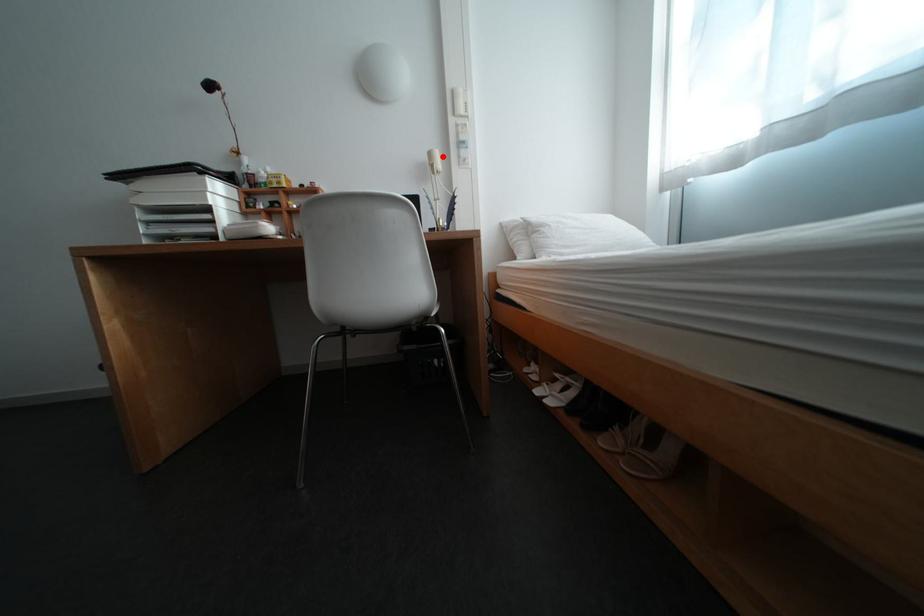
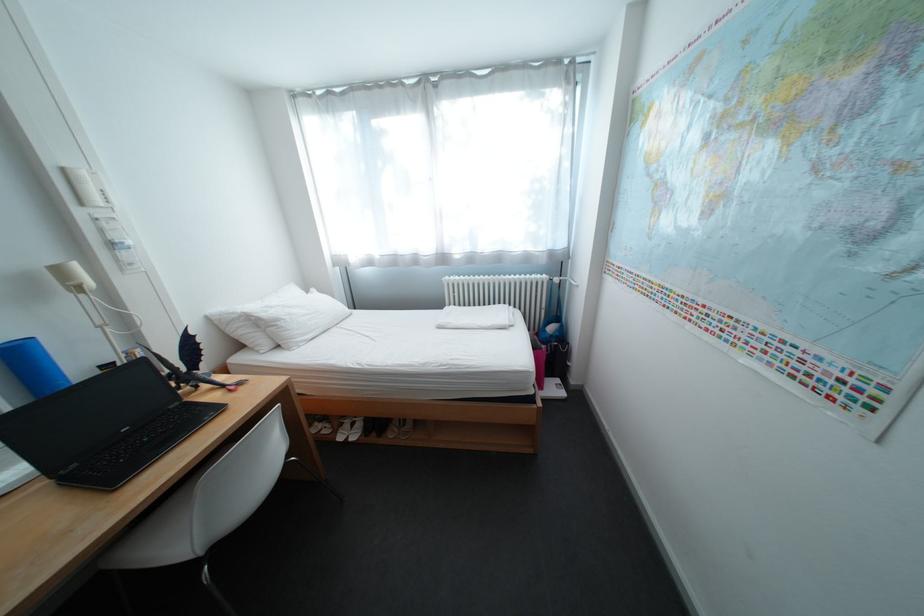
Find the pixel in the second image that matches the highlighted location in the first image.

(71, 272)